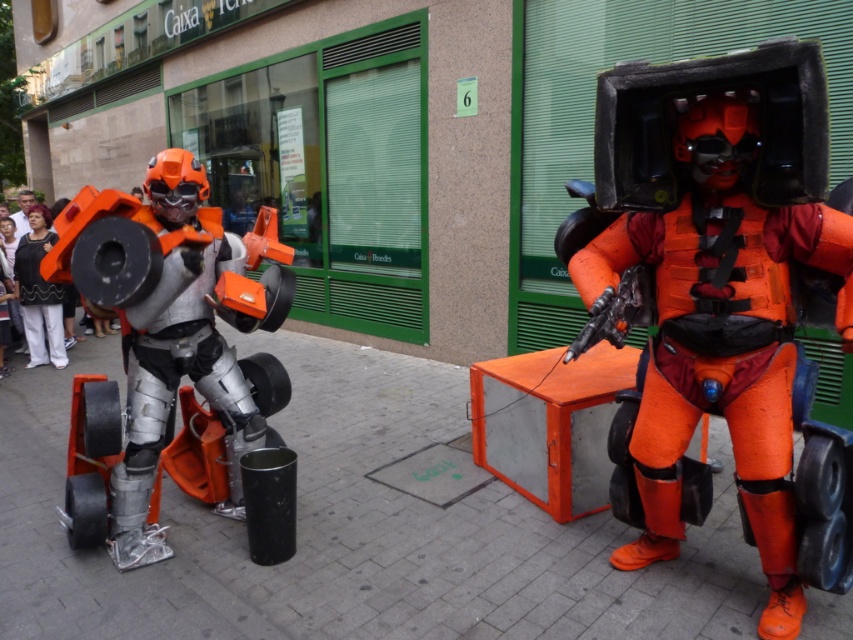
Question: Which object appears farthest from the camera in this image?

Choices:
 (A) matte black pants at center
 (B) matte orange robot at center

Answer: (A)

Question: Which object appears farthest from the camera in this image?

Choices:
 (A) orange matte robot at right
 (B) matte black pants at center
 (C) matte orange robot at center

Answer: (B)

Question: Is orange matte robot at right above matte black pants at center?

Choices:
 (A) yes
 (B) no

Answer: (B)

Question: Can you confirm if orange matte robot at right is wider than matte black pants at center?

Choices:
 (A) no
 (B) yes

Answer: (B)

Question: Which point is farther to the camera?

Choices:
 (A) matte black pants at center
 (B) orange matte robot at right

Answer: (A)

Question: Does matte orange robot at center have a greater width compared to matte black pants at center?

Choices:
 (A) no
 (B) yes

Answer: (B)